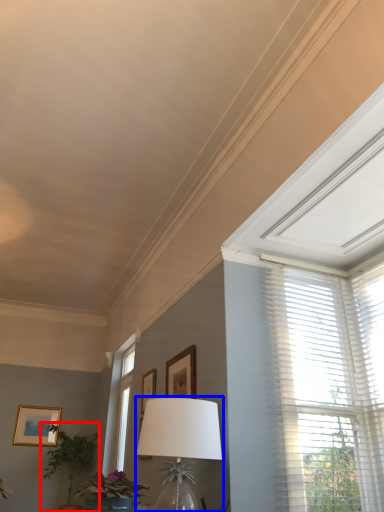
Question: Which point is closer to the camera, houseplant (highlighted by a red box) or table lamp (highlighted by a blue box)?

Choices:
 (A) houseplant
 (B) table lamp

Answer: (B)